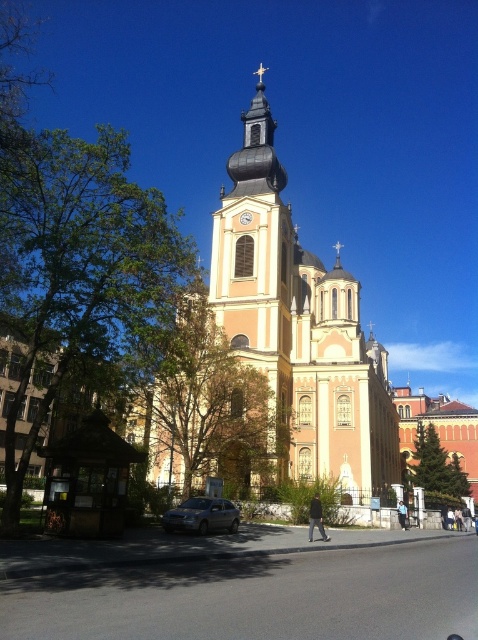
What are the coordinates of `pink stone church at center` in the screenshot? It's located at (300, 328).

Can you confirm if pink stone church at center is positioned to the right of satin silver sedan at lower center?

Correct, you'll find pink stone church at center to the right of satin silver sedan at lower center.

Which is behind, point (314, 337) or point (209, 529)?

The point (314, 337) is behind.

I want to click on pink stone church at center, so click(300, 328).

Does pink stone church at center have a larger size compared to matte red clock at center?

Correct, pink stone church at center is larger in size than matte red clock at center.

Is pink stone church at center below matte red clock at center?

Actually, pink stone church at center is above matte red clock at center.

Between point (308, 480) and point (241, 218), which one is positioned behind?

The point (241, 218) is behind.

Identify the location of pink stone church at center. (300, 328).

Can you confirm if satin silver sedan at lower center is positioned below matte red clock at center?

Indeed, satin silver sedan at lower center is positioned under matte red clock at center.

Between satin silver sedan at lower center and matte red clock at center, which one has more height?

satin silver sedan at lower center

Image resolution: width=478 pixels, height=640 pixels. What do you see at coordinates (202, 516) in the screenshot?
I see `satin silver sedan at lower center` at bounding box center [202, 516].

You are a GUI agent. You are given a task and a screenshot of the screen. Output one action in this format:
    pyautogui.click(x=<x>, y=<y>)
    Task: Click on the satin silver sedan at lower center
    The width and height of the screenshot is (478, 640).
    Given the screenshot: What is the action you would take?
    pyautogui.click(x=202, y=516)